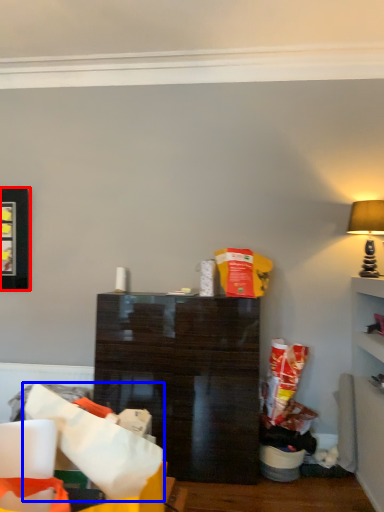
Question: Which object is further to the camera taking this photo, picture frame (highlighted by a red box) or paper bag (highlighted by a blue box)?

Choices:
 (A) picture frame
 (B) paper bag

Answer: (A)